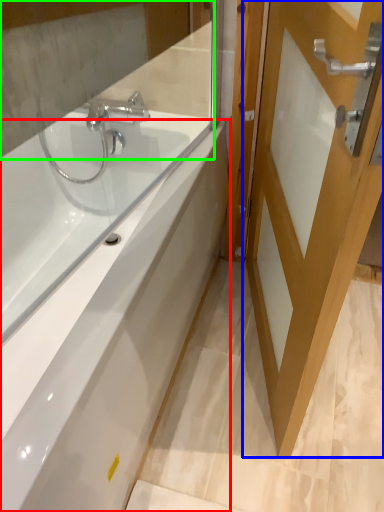
Question: Estimate the real-world distances between objects in this image. Which object is farther from bathtub (highlighted by a red box), door (highlighted by a blue box) or mirror (highlighted by a green box)?

Choices:
 (A) door
 (B) mirror

Answer: (B)